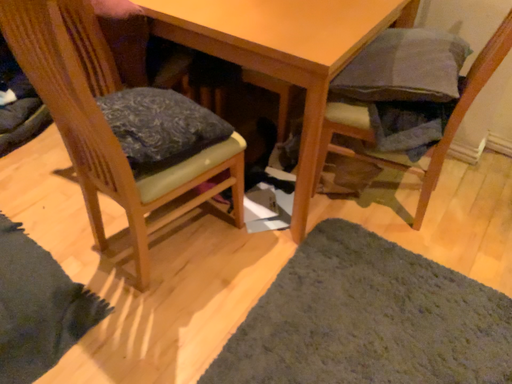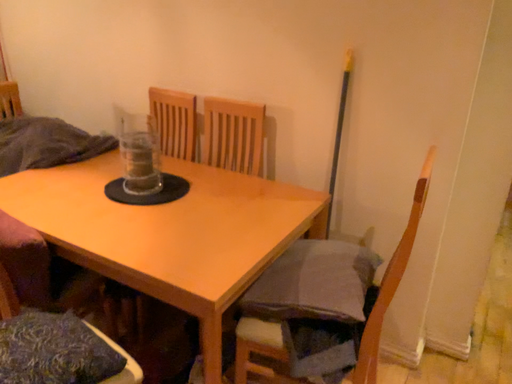
Question: How did the camera likely rotate when shooting the video?

Choices:
 (A) rotated downward
 (B) rotated upward

Answer: (B)